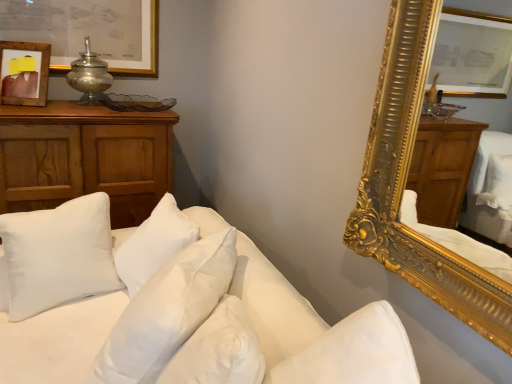
Locate an element on the screen. The width and height of the screenshot is (512, 384). vacant space in front of wooden picture frame at upper left is located at coordinates (15, 100).